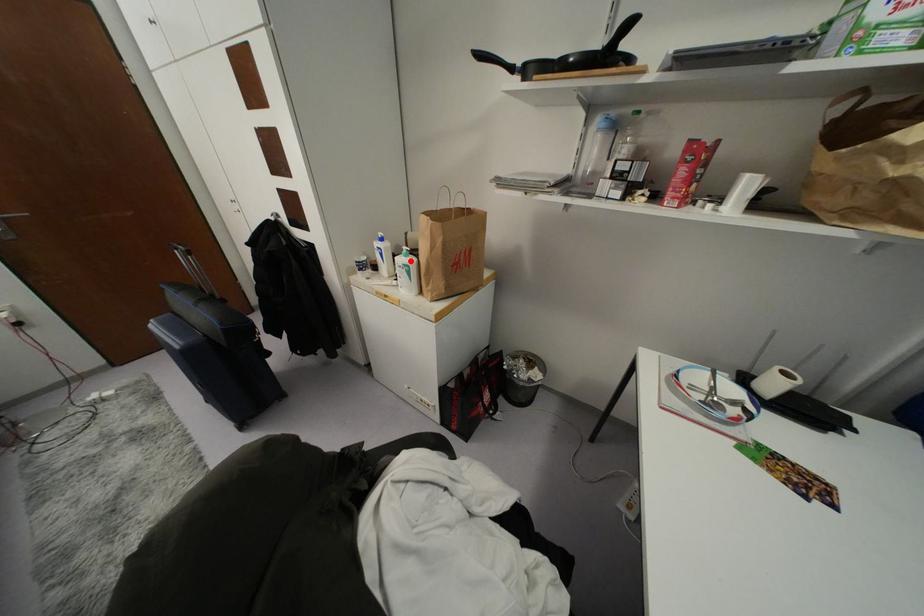
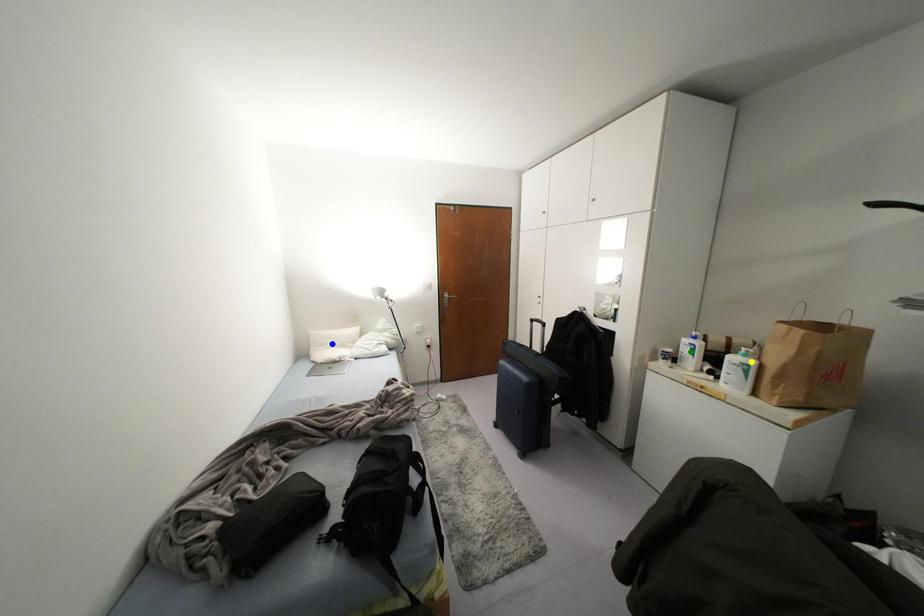
Question: I am providing you with two images of the same scene from different viewpoints. A red point is marked on the first image. You are given multiple points on the second image. Can you choose the point in image 2 that corresponds to the point in image 1?

Choices:
 (A) blue point
 (B) green point
 (C) yellow point

Answer: (C)